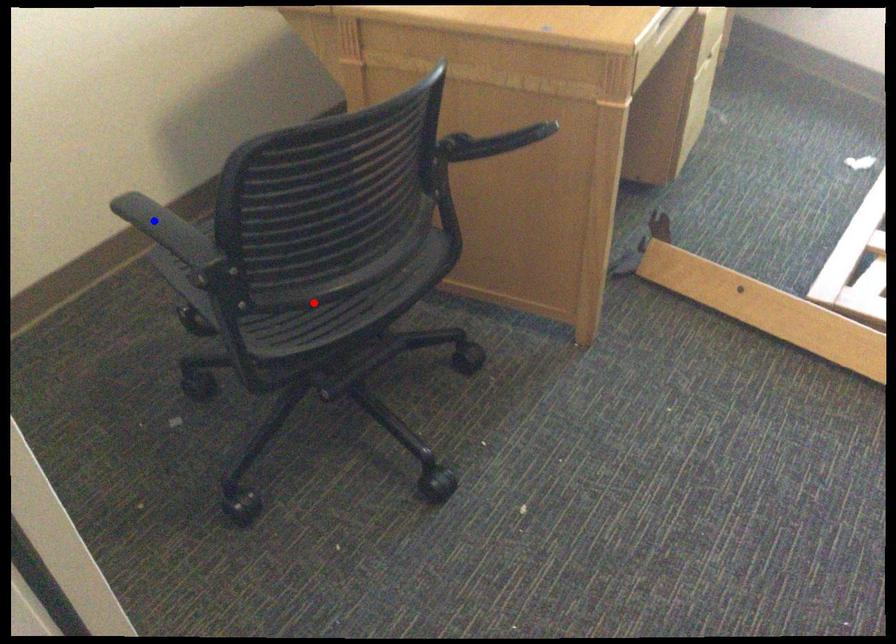
Question: In the image, two points are highlighted. Which point is nearer to the camera? Reply with the corresponding letter.

Choices:
 (A) blue point
 (B) red point

Answer: (B)